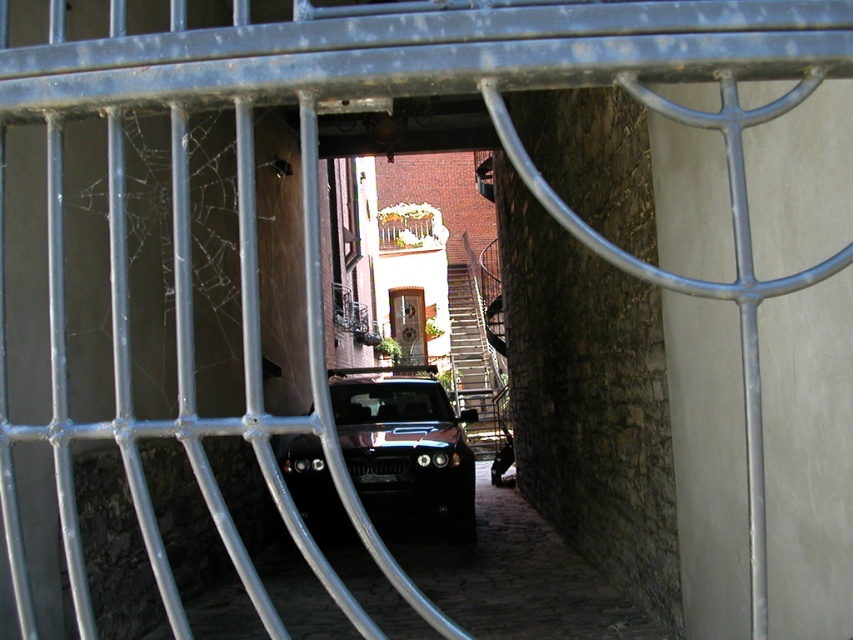
Does point (444, 449) come closer to viewer compared to point (392, 307)?

Yes, it is.

The width and height of the screenshot is (853, 640). Describe the element at coordinates (405, 445) in the screenshot. I see `glossy black jeep at center` at that location.

Where is `glossy black jeep at center`? The image size is (853, 640). glossy black jeep at center is located at coordinates (405, 445).

Does glossy black jeep at center appear on the left side of metallic silver stairs at center?

Correct, you'll find glossy black jeep at center to the left of metallic silver stairs at center.

Who is more distant from viewer, (369, 476) or (480, 456)?

Point (480, 456)

Is point (297, 465) less distant than point (488, 353)?

Yes.

What are the coordinates of `glossy black jeep at center` in the screenshot? It's located at (405, 445).

Can you confirm if metallic silver stairs at center is positioned below wooden door at center?

Indeed, metallic silver stairs at center is positioned under wooden door at center.

Between metallic silver stairs at center and wooden door at center, which one is positioned higher?

Positioned higher is wooden door at center.

You are a GUI agent. You are given a task and a screenshot of the screen. Output one action in this format:
    pyautogui.click(x=<x>, y=<y>)
    Task: Click on the metallic silver stairs at center
    The image size is (853, 640).
    Given the screenshot: What is the action you would take?
    pyautogui.click(x=474, y=362)